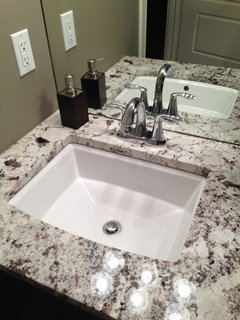
Locate an element on the screen. black soap dispenser is located at coordinates (80, 106).